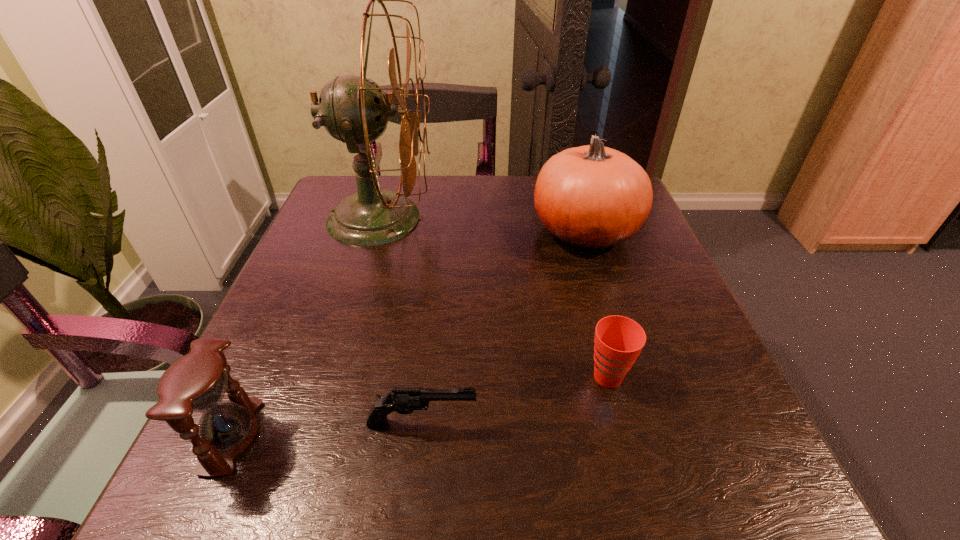
Find the location of a particular element. free point that satisfies the following two spatial constraints: 1. in front of the pumpkin, directing air flow; 2. on the left side of the fan is located at coordinates (375, 233).